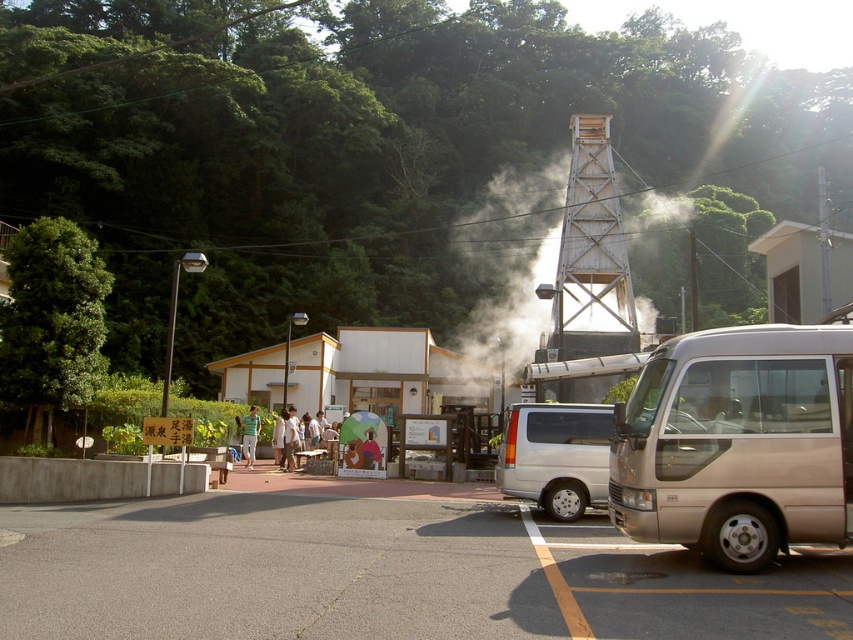
In order to click on wooden lattice tower at center in this screenshot , I will do `click(590, 256)`.

Is point (589, 262) positioned in front of point (247, 465)?

No.

Where is `wooden lattice tower at center`? The image size is (853, 640). wooden lattice tower at center is located at coordinates (590, 256).

Does gold metallic van at right appear over green fabric umbrella at center?

Indeed, gold metallic van at right is positioned over green fabric umbrella at center.

Does gold metallic van at right appear under green fabric umbrella at center?

Actually, gold metallic van at right is above green fabric umbrella at center.

Image resolution: width=853 pixels, height=640 pixels. What do you see at coordinates (738, 444) in the screenshot? I see `gold metallic van at right` at bounding box center [738, 444].

What are the coordinates of `gold metallic van at right` in the screenshot? It's located at (738, 444).

Is gold metallic van at right closer to the viewer compared to wooden lattice tower at center?

Yes, gold metallic van at right is in front of wooden lattice tower at center.

Which is more to the left, gold metallic van at right or wooden lattice tower at center?

gold metallic van at right

Find the location of a particular element. This screenshot has width=853, height=640. gold metallic van at right is located at coordinates (738, 444).

Locate an element on the screen. This screenshot has width=853, height=640. gold metallic van at right is located at coordinates (738, 444).